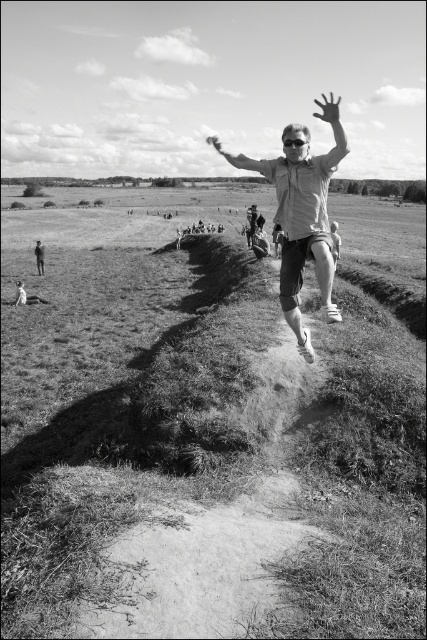
Question: Can you confirm if transparent plastic hand at upper center is thinner than matte white shirt at center?

Choices:
 (A) yes
 (B) no

Answer: (B)

Question: Estimate the real-world distances between objects in this image. Which object is closer to the white matte hand at center?

Choices:
 (A) matte skin hand at center
 (B) smooth skin person at lower left
 (C) grassy hillside at center
 (D) matte white shirt at center

Answer: (C)

Question: Which object is positioned farthest from the light gray casual shirt at center?

Choices:
 (A) matte skin hand at center
 (B) grassy hillside at center
 (C) transparent plastic hand at upper center

Answer: (C)

Question: Among these points, which one is nearest to the camera?

Choices:
 (A) (248, 244)
 (B) (20, 296)

Answer: (B)

Question: Can you confirm if light gray casual shirt at center is positioned below white matte hand at center?

Choices:
 (A) no
 (B) yes

Answer: (B)

Question: Can you confirm if grassy hillside at center is wider than matte skin hand at center?

Choices:
 (A) yes
 (B) no

Answer: (A)